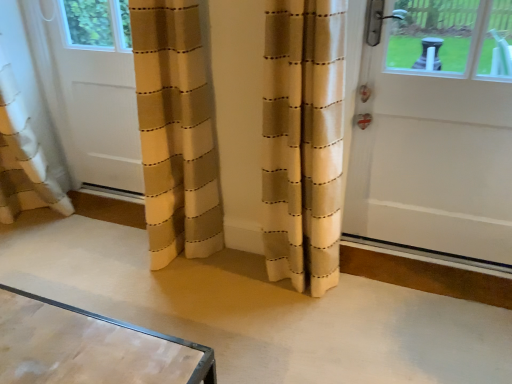
Image resolution: width=512 pixels, height=384 pixels. What do you see at coordinates (434, 132) in the screenshot? I see `white glossy door at right, marked as the first door in a right-to-left arrangement` at bounding box center [434, 132].

This screenshot has height=384, width=512. What are the coordinates of `white glossy door at right, the second door from the left` in the screenshot? It's located at (434, 132).

The image size is (512, 384). Describe the element at coordinates (97, 90) in the screenshot. I see `white matte door at left, marked as the 1th door in a left-to-right arrangement` at that location.

Find the location of a particular element. The image size is (512, 384). white matte door at left, marked as the 1th door in a left-to-right arrangement is located at coordinates 97,90.

Locate an element on the screen. This screenshot has height=384, width=512. white glossy door at right, marked as the first door in a right-to-left arrangement is located at coordinates (434, 132).

Is white glossy door at right, marked as the first door in a right-to-left arrangement, to the left or to the right of white matte door at left, the 2th door in the right-to-left sequence, in the image?

From the image, it's evident that white glossy door at right, marked as the first door in a right-to-left arrangement, is to the right of white matte door at left, the 2th door in the right-to-left sequence.

Is white glossy door at right, marked as the first door in a right-to-left arrangement, behind white matte door at left, the 2th door in the right-to-left sequence?

No, it is in front of white matte door at left, the 2th door in the right-to-left sequence.

Is point (382, 55) less distant than point (127, 119)?

Yes, it is in front of point (127, 119).

From the image's perspective, which one is positioned higher, white glossy door at right, the second door from the left, or white matte door at left, marked as the 1th door in a left-to-right arrangement?

white matte door at left, marked as the 1th door in a left-to-right arrangement, is shown above in the image.

From a real-world perspective, which is physically below, white glossy door at right, the second door from the left, or white matte door at left, the 2th door in the right-to-left sequence?

white matte door at left, the 2th door in the right-to-left sequence.

Is white glossy door at right, the second door from the left, wider than white matte door at left, the 2th door in the right-to-left sequence?

Yes.

Who is shorter, white glossy door at right, marked as the first door in a right-to-left arrangement, or white matte door at left, marked as the 1th door in a left-to-right arrangement?

white matte door at left, marked as the 1th door in a left-to-right arrangement, is shorter.

Is white glossy door at right, marked as the first door in a right-to-left arrangement, bigger or smaller than white matte door at left, marked as the 1th door in a left-to-right arrangement?

white glossy door at right, marked as the first door in a right-to-left arrangement, is bigger than white matte door at left, marked as the 1th door in a left-to-right arrangement.

Is white glossy door at right, marked as the first door in a right-to-left arrangement, located outside white matte door at left, marked as the 1th door in a left-to-right arrangement?

That's correct, white glossy door at right, marked as the first door in a right-to-left arrangement, is outside of white matte door at left, marked as the 1th door in a left-to-right arrangement.

Does white glossy door at right, the second door from the left, touch white matte door at left, marked as the 1th door in a left-to-right arrangement?

white glossy door at right, the second door from the left, and white matte door at left, marked as the 1th door in a left-to-right arrangement, are not in contact.

In the scene shown: Is white glossy door at right, marked as the first door in a right-to-left arrangement, aimed at white matte door at left, marked as the 1th door in a left-to-right arrangement?

No, white glossy door at right, marked as the first door in a right-to-left arrangement, is not oriented towards white matte door at left, marked as the 1th door in a left-to-right arrangement.

The width and height of the screenshot is (512, 384). What are the coordinates of `door located on the left of white glossy door at right, the second door from the left` in the screenshot? It's located at (97, 90).

In the scene shown: Considering the relative positions of white matte door at left, marked as the 1th door in a left-to-right arrangement, and white glossy door at right, marked as the first door in a right-to-left arrangement, in the image provided, is white matte door at left, marked as the 1th door in a left-to-right arrangement, to the right of white glossy door at right, marked as the first door in a right-to-left arrangement, from the viewer's perspective?

In fact, white matte door at left, marked as the 1th door in a left-to-right arrangement, is to the left of white glossy door at right, marked as the first door in a right-to-left arrangement.

Does white matte door at left, the 2th door in the right-to-left sequence, lie behind white glossy door at right, the second door from the left?

Yes, it is behind white glossy door at right, the second door from the left.

Is point (129, 136) behind point (362, 187)?

Yes, point (129, 136) is farther from viewer.

From the image's perspective, is white matte door at left, marked as the 1th door in a left-to-right arrangement, over white glossy door at right, the second door from the left?

Indeed, from the image's perspective, white matte door at left, marked as the 1th door in a left-to-right arrangement, is shown above white glossy door at right, the second door from the left.

From a real-world perspective, between white matte door at left, the 2th door in the right-to-left sequence, and white glossy door at right, the second door from the left, who is vertically lower?

In real-world perspective, white matte door at left, the 2th door in the right-to-left sequence, is lower.

Can you confirm if white matte door at left, the 2th door in the right-to-left sequence, is wider than white glossy door at right, the second door from the left?

No, white matte door at left, the 2th door in the right-to-left sequence, is not wider than white glossy door at right, the second door from the left.

In terms of height, does white matte door at left, marked as the 1th door in a left-to-right arrangement, look taller or shorter compared to white glossy door at right, marked as the first door in a right-to-left arrangement?

Clearly, white matte door at left, marked as the 1th door in a left-to-right arrangement, is shorter compared to white glossy door at right, marked as the first door in a right-to-left arrangement.

Between white matte door at left, the 2th door in the right-to-left sequence, and white glossy door at right, marked as the first door in a right-to-left arrangement, which one has smaller size?

white matte door at left, the 2th door in the right-to-left sequence, is smaller.

Based on the photo, can white glossy door at right, marked as the first door in a right-to-left arrangement, be found inside white matte door at left, marked as the 1th door in a left-to-right arrangement?

No.

Is white matte door at left, marked as the 1th door in a left-to-right arrangement, next to white glossy door at right, the second door from the left?

white matte door at left, marked as the 1th door in a left-to-right arrangement, is not next to white glossy door at right, the second door from the left, and they're not touching.

Does white matte door at left, marked as the 1th door in a left-to-right arrangement, turn towards white glossy door at right, marked as the first door in a right-to-left arrangement?

No, white matte door at left, marked as the 1th door in a left-to-right arrangement, is not aimed at white glossy door at right, marked as the first door in a right-to-left arrangement.

How much distance is there between white matte door at left, marked as the 1th door in a left-to-right arrangement, and white glossy door at right, the second door from the left?

They are 1.30 meters apart.

Where is `door that is under the white glossy door at right, the second door from the left (from a real-world perspective)`? The height and width of the screenshot is (384, 512). door that is under the white glossy door at right, the second door from the left (from a real-world perspective) is located at coordinates (97, 90).

Locate an element on the screen. This screenshot has width=512, height=384. door in front of the white matte door at left, marked as the 1th door in a left-to-right arrangement is located at coordinates (434, 132).

This screenshot has width=512, height=384. What are the coordinates of `door below the white glossy door at right, the second door from the left (from a real-world perspective)` in the screenshot? It's located at (97, 90).